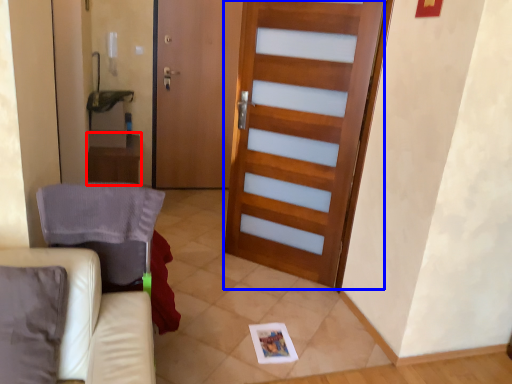
Question: Which object appears farthest to the camera in this image, table (highlighted by a red box) or barn door (highlighted by a blue box)?

Choices:
 (A) table
 (B) barn door

Answer: (A)